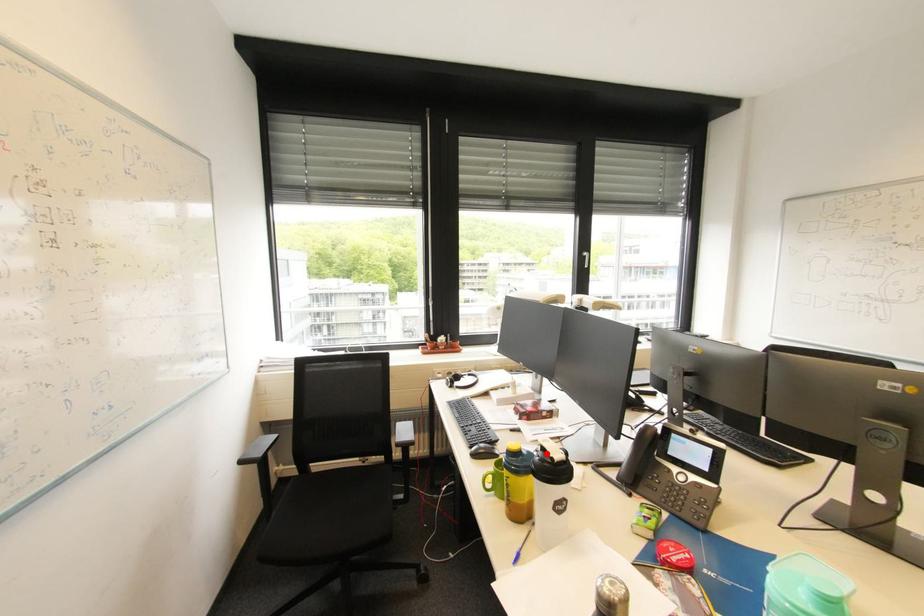
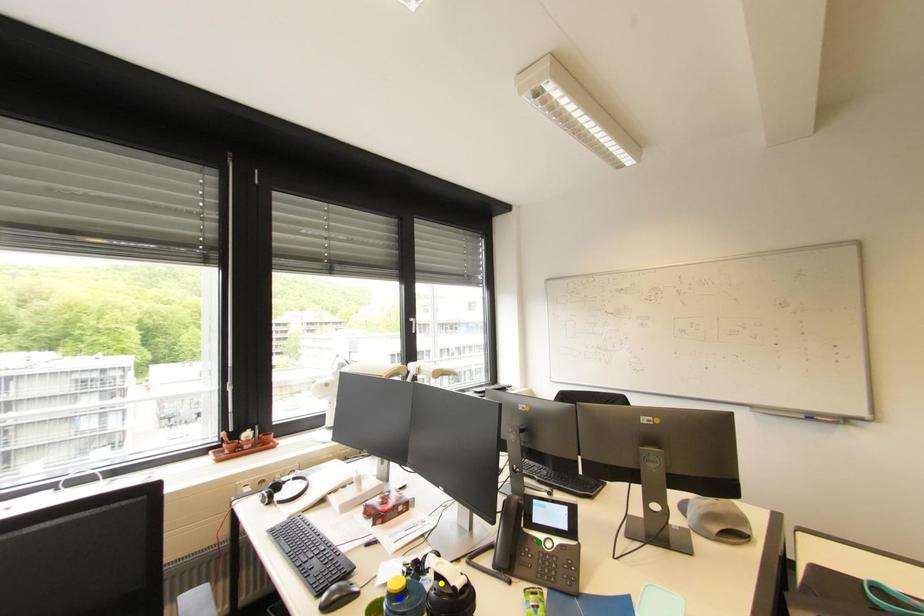
Question: I am providing you with two images of the same scene from different viewpoints. A red point is marked on the first image. You are given multiple points on the second image. Which point in image 2 is actually the same real-world point as the red point in image 1?

Choices:
 (A) blue point
 (B) yellow point
 (C) green point

Answer: (B)